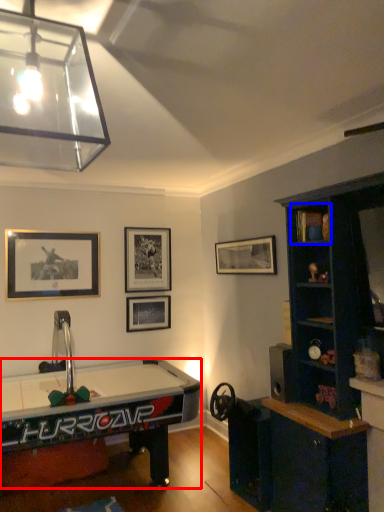
Question: Which point is closer to the camera, desk (highlighted by a red box) or cabinet (highlighted by a blue box)?

Choices:
 (A) desk
 (B) cabinet

Answer: (A)